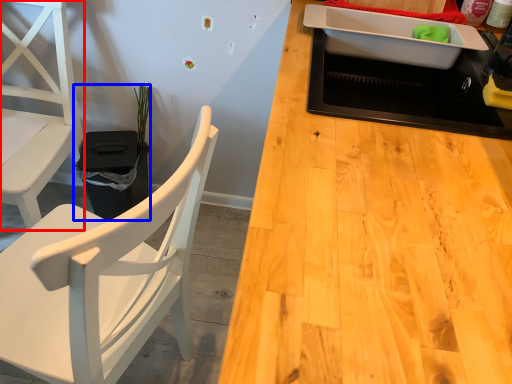
Question: Which point is further to the camera, chair (highlighted by a red box) or houseplant (highlighted by a blue box)?

Choices:
 (A) chair
 (B) houseplant

Answer: (B)